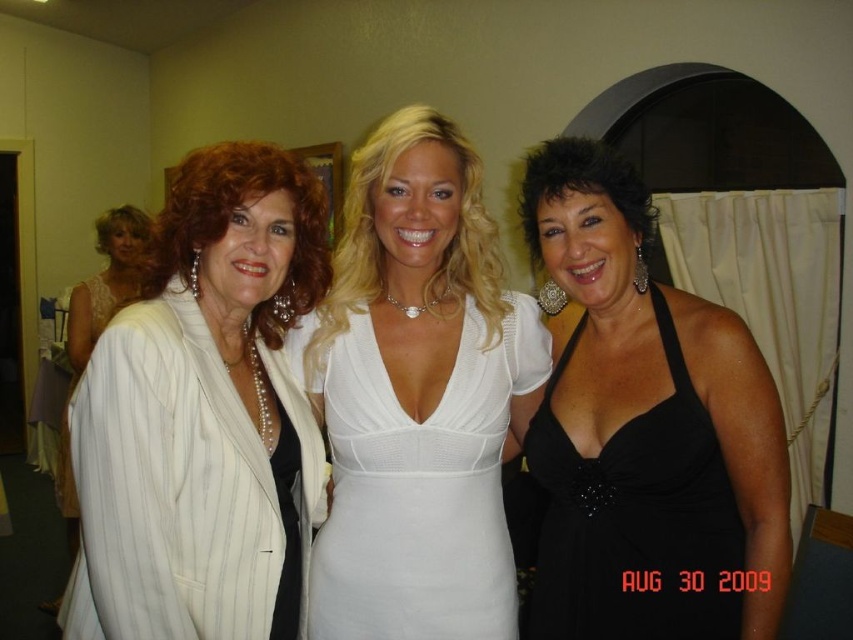
Between black satin dress at center and white striped suit at left, which one has less height?

Standing shorter between the two is black satin dress at center.

Which is in front, point (554, 372) or point (56, 483)?

Point (554, 372)

Which is in front, point (631, 480) or point (103, 228)?

Point (631, 480) is in front.

In order to click on black satin dress at center in this screenshot , I will do `click(630, 518)`.

The image size is (853, 640). I want to click on white mesh dress at center, so click(x=418, y=483).

Is point (492, 412) more distant than point (68, 465)?

No, (492, 412) is closer to viewer.

This screenshot has height=640, width=853. Find the location of `white mesh dress at center`. white mesh dress at center is located at coordinates (418, 483).

How far apart are white striped suit at left and white satin dress at left?

The distance of white striped suit at left from white satin dress at left is 3.83 inches.

Which is above, white striped suit at left or white satin dress at left?

white striped suit at left is above.

Where is `white striped suit at left`? This screenshot has width=853, height=640. white striped suit at left is located at coordinates (96, 326).